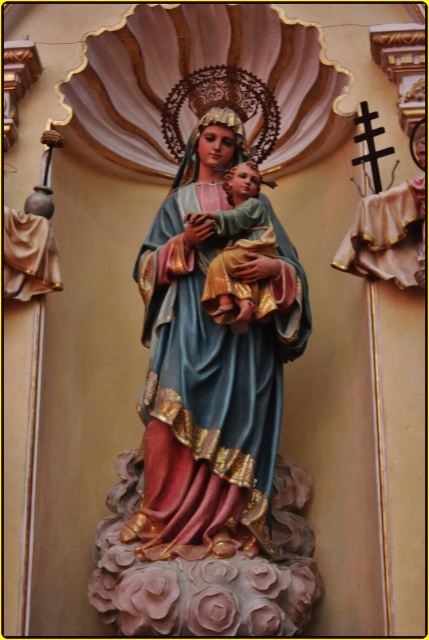
Is the position of polychrome wood statue of madonna and child at center more distant than that of gold textured fabric at center?

No, it is in front of gold textured fabric at center.

Where is `polychrome wood statue of madonna and child at center`? This screenshot has height=640, width=429. polychrome wood statue of madonna and child at center is located at coordinates (210, 371).